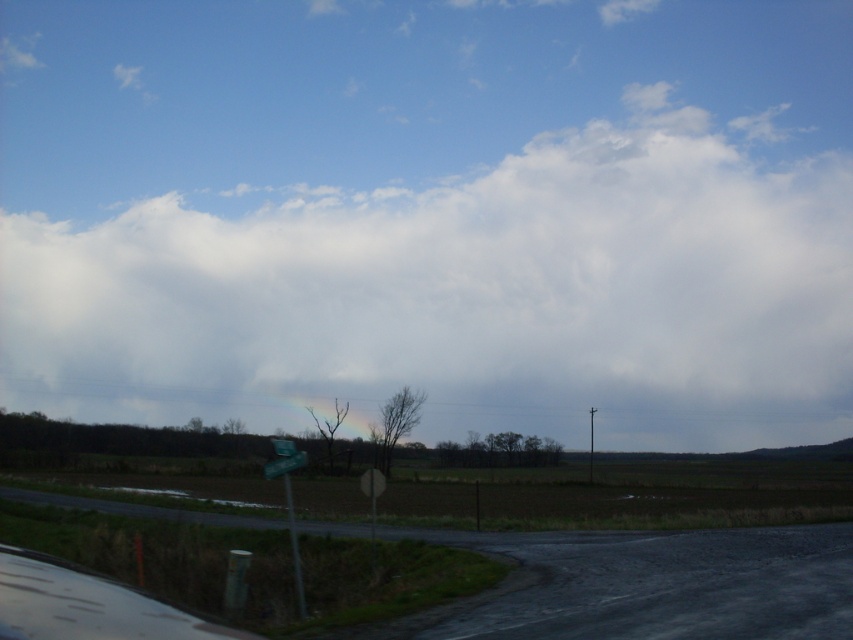
Question: Is green plastic street sign at lower left behind green plastic sign at lower center?

Choices:
 (A) yes
 (B) no

Answer: (B)

Question: Which object is the farthest from the green plastic street sign at lower left?

Choices:
 (A) rainbow translucent at center
 (B) green plastic sign at lower center
 (C) white fluffy cloud at upper center

Answer: (C)

Question: Which object is positioned closest to the white fluffy cloud at upper center?

Choices:
 (A) rainbow translucent at center
 (B) green plastic sign at lower center

Answer: (A)

Question: Which object is the farthest from the green plastic sign at lower center?

Choices:
 (A) green plastic street sign at lower left
 (B) white fluffy cloud at upper center

Answer: (B)

Question: Does rainbow translucent at center come in front of green plastic sign at lower center?

Choices:
 (A) yes
 (B) no

Answer: (B)

Question: Is rainbow translucent at center below green plastic sign at lower center?

Choices:
 (A) yes
 (B) no

Answer: (A)